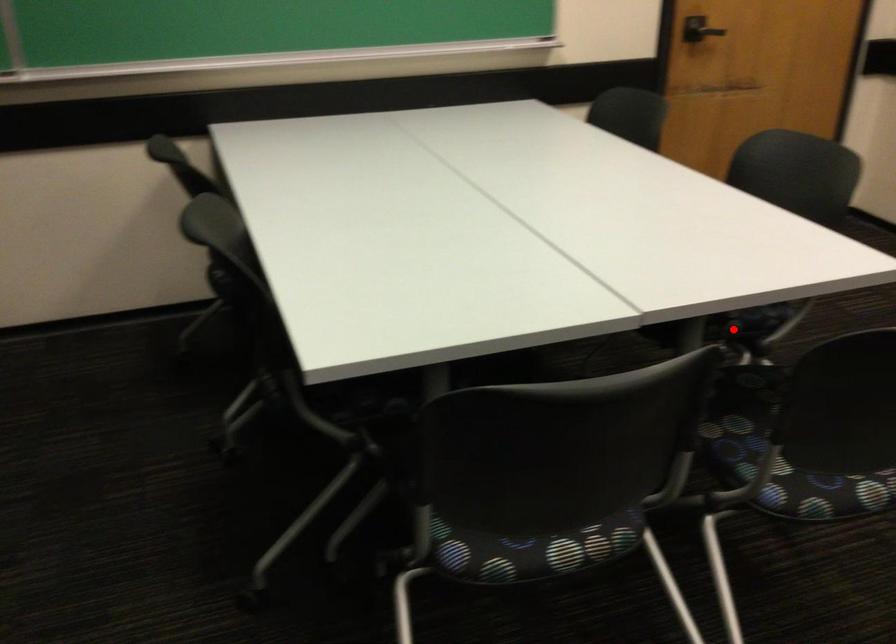
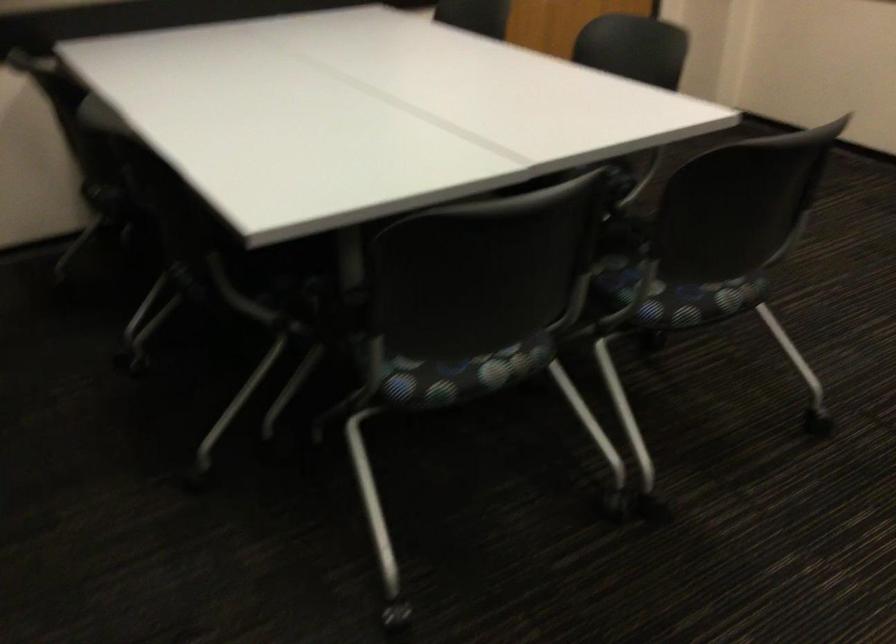
Question: I am providing you with two images of the same scene from different viewpoints. A red point is marked on the first image. Is the red point's position out of view in image 2?

Choices:
 (A) Yes
 (B) No

Answer: (A)